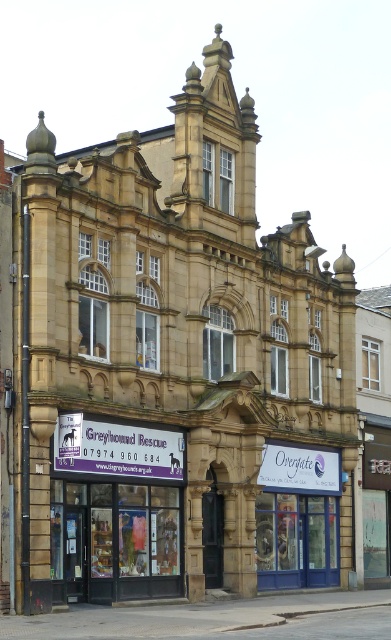
You are a delivery person who needs to hang a new sign that is 2 meters tall. The existing signs are the purple fabric sign at lower center and the white plastic sign at center. Which existing sign can the new sign be placed next to without blocking the entrance?

The new sign that is 2 meters tall can be placed next to the purple fabric sign at lower center because it is much taller than the white plastic sign at center, so there would be enough vertical space available.

You are a delivery person needing to find the correct storefront for a package. The package is addressed to the business with the smaller sign. Which storefront should you choose between the purple fabric sign at lower center and the white plastic sign at center?

The purple fabric sign at lower center is smaller than the white plastic sign at center, so you should choose the purple fabric sign at lower center for the package.

You are standing at the entrance of the building and want to walk towards the point marked as point (148, 445). Which direction should you move relative to point (267, 461)?

You should move towards the point (148, 445), which is in front of point (267, 461).